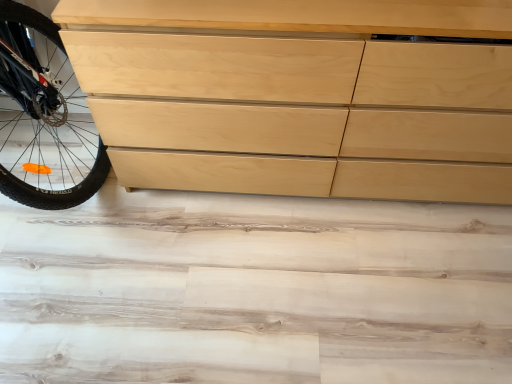
Question: Is natural wood chest of drawers at left wider or thinner than wooden dresser at upper left?

Choices:
 (A) thin
 (B) wide

Answer: (A)

Question: Visually, is natural wood chest of drawers at left positioned to the left or to the right of wooden dresser at upper left?

Choices:
 (A) left
 (B) right

Answer: (B)

Question: From the image's perspective, is natural wood chest of drawers at left positioned above or below wooden dresser at upper left?

Choices:
 (A) above
 (B) below

Answer: (A)

Question: In terms of size, does wooden dresser at upper left appear bigger or smaller than natural wood chest of drawers at left?

Choices:
 (A) big
 (B) small

Answer: (B)

Question: Is wooden dresser at upper left taller or shorter than natural wood chest of drawers at left?

Choices:
 (A) tall
 (B) short

Answer: (B)

Question: Do you think wooden dresser at upper left is within natural wood chest of drawers at left, or outside of it?

Choices:
 (A) inside
 (B) outside

Answer: (B)

Question: From the image's perspective, is wooden dresser at upper left located above or below natural wood chest of drawers at left?

Choices:
 (A) below
 (B) above

Answer: (A)